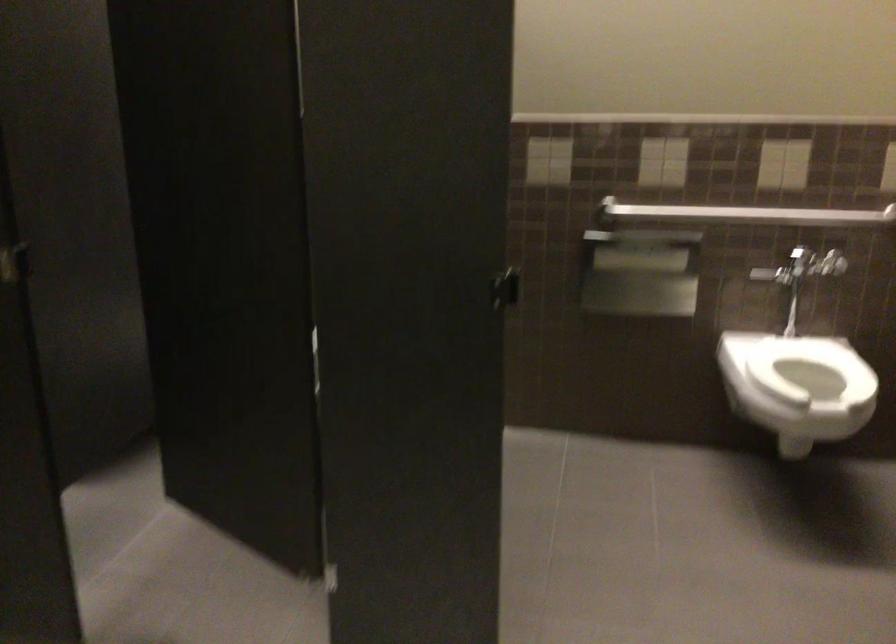
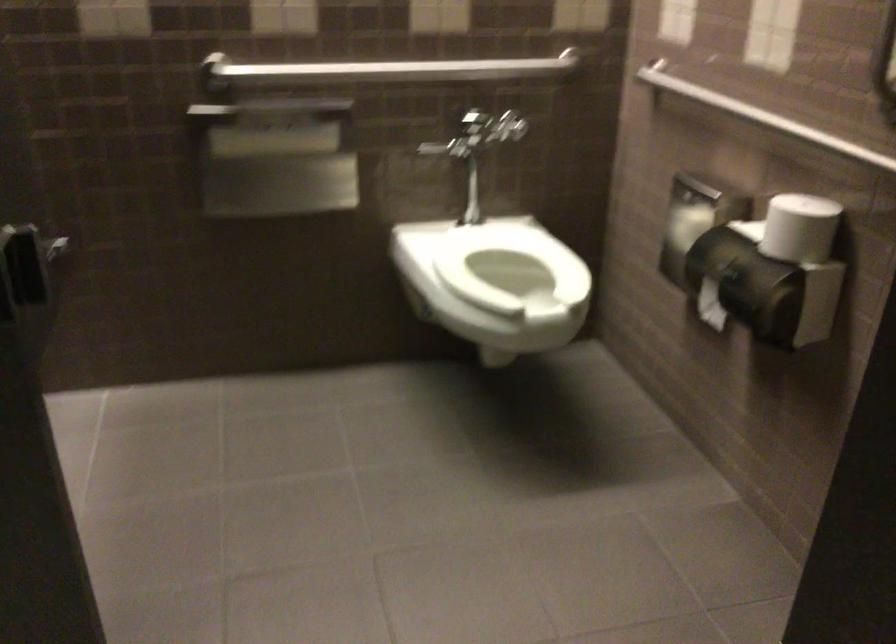
Question: In a continuous first-person perspective shot, in which direction is the camera moving?

Choices:
 (A) Left
 (B) Right
 (C) Forward
 (D) Backward

Answer: (C)